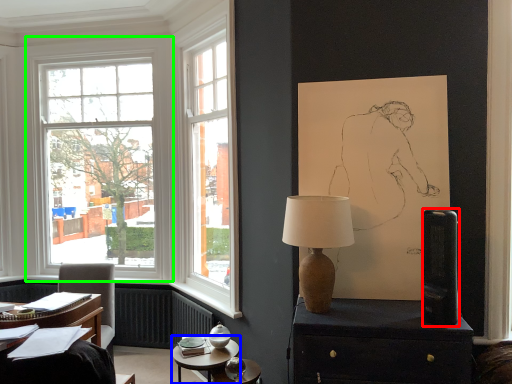
Question: Which object is positioned farthest from loudspeaker (highlighted by a red box)? Select from table (highlighted by a blue box) and window (highlighted by a green box).

Choices:
 (A) table
 (B) window

Answer: (B)